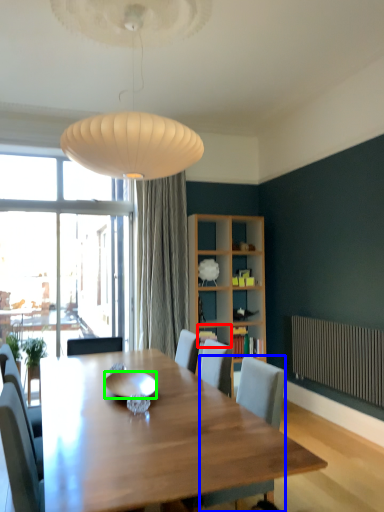
Question: Estimate the real-world distances between objects in this image. Which object is closer to shelf (highlighted by a red box), chair (highlighted by a blue box) or bowl (highlighted by a green box)?

Choices:
 (A) chair
 (B) bowl

Answer: (B)